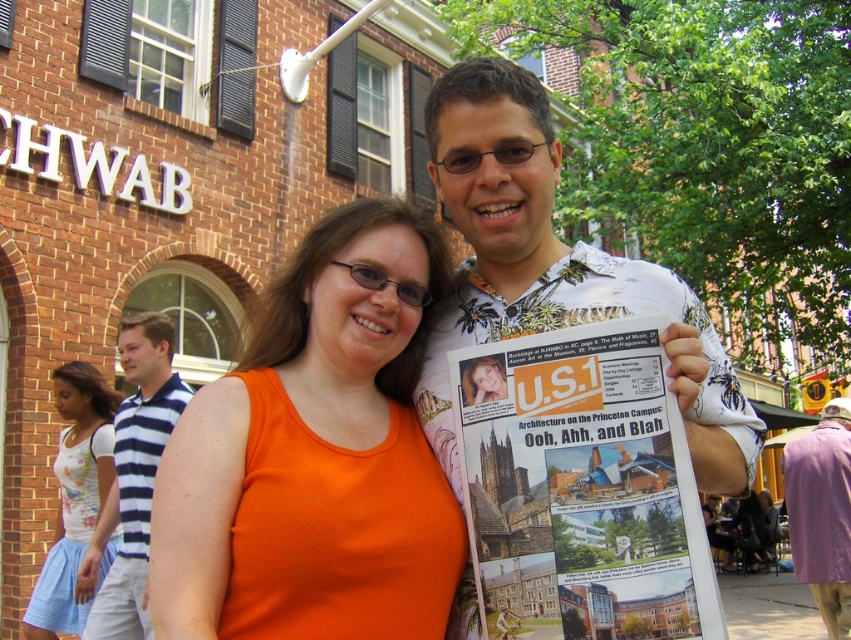
Does point (546, 136) come behind point (810, 513)?

No, (546, 136) is closer to viewer.

Can you confirm if white floral shirt at center is shorter than purple fabric coat at lower right?

No.

What do you see at coordinates (553, 269) in the screenshot? I see `white floral shirt at center` at bounding box center [553, 269].

Identify the location of white floral shirt at center. (553, 269).

This screenshot has width=851, height=640. Find the location of `orange fabric shirt at center`. orange fabric shirt at center is located at coordinates (315, 454).

Describe the element at coordinates (315, 454) in the screenshot. I see `orange fabric shirt at center` at that location.

The width and height of the screenshot is (851, 640). I want to click on orange fabric shirt at center, so (x=315, y=454).

From the picture: Is white floral shirt at center positioned in front of white floral fabric dress at lower left?

Yes, it is.

Can you confirm if white floral shirt at center is wider than white floral fabric dress at lower left?

Correct, the width of white floral shirt at center exceeds that of white floral fabric dress at lower left.

What are the coordinates of `white floral shirt at center` in the screenshot? It's located at (553, 269).

Image resolution: width=851 pixels, height=640 pixels. In order to click on white floral shirt at center in this screenshot , I will do `click(553, 269)`.